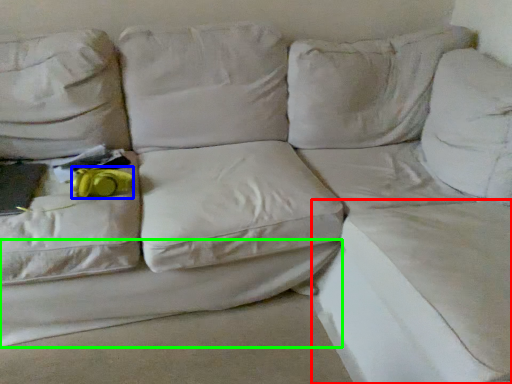
Question: Estimate the real-world distances between objects in this image. Which object is farther from sheet (highlighted by a red box), stuff (highlighted by a blue box) or sheet (highlighted by a green box)?

Choices:
 (A) stuff
 (B) sheet

Answer: (A)